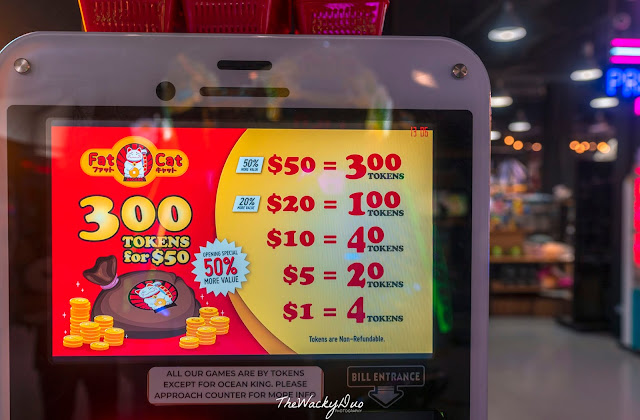
Locate an element on the screen. The height and width of the screenshot is (420, 640). plastic basket is located at coordinates (140, 17), (236, 19), (344, 19).